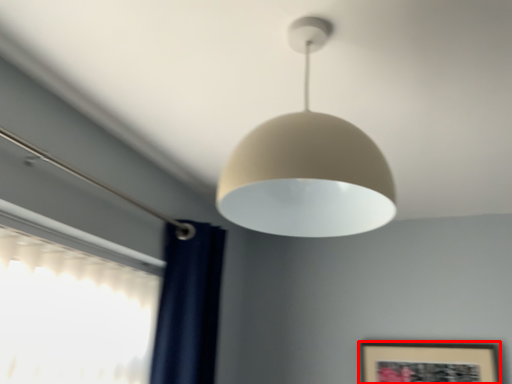
Question: Considering the relative positions of picture frame (annotated by the red box) and lamp in the image provided, where is picture frame (annotated by the red box) located with respect to the staircase?

Choices:
 (A) left
 (B) right

Answer: (B)